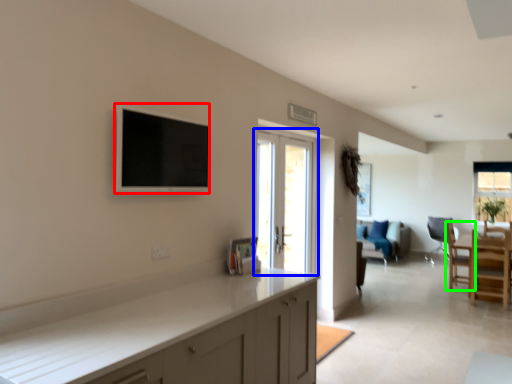
Question: Based on their relative distances, which object is nearer to flat (highlighted by a red box)? Choose from door (highlighted by a blue box) and chair (highlighted by a green box).

Choices:
 (A) door
 (B) chair

Answer: (A)